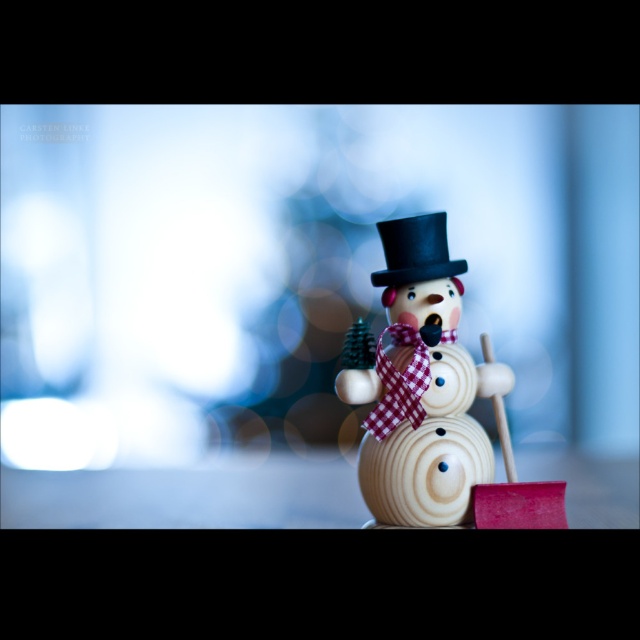
Question: Which point is farther to the camera?

Choices:
 (A) (435, 493)
 (B) (412, 234)

Answer: (B)

Question: Is wooden snowman at center positioned at the back of black felt top hat at center?

Choices:
 (A) yes
 (B) no

Answer: (B)

Question: Does wooden snowman at center have a larger size compared to black felt top hat at center?

Choices:
 (A) yes
 (B) no

Answer: (A)

Question: Which point is closer to the camera taking this photo?

Choices:
 (A) (426, 237)
 (B) (424, 483)

Answer: (B)

Question: Is wooden snowman at center bigger than black felt top hat at center?

Choices:
 (A) no
 (B) yes

Answer: (B)

Question: Which object appears closest to the camera in this image?

Choices:
 (A) black felt top hat at center
 (B) wooden snowman at center

Answer: (B)